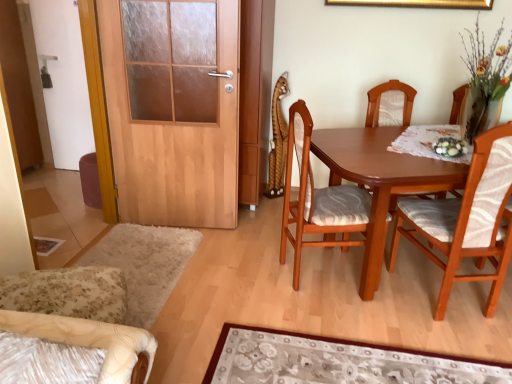
Where is `free region under wooden chair with patterned cushion at center, positioned as the third chair in right-to-left order (from a real-world perspective)`? free region under wooden chair with patterned cushion at center, positioned as the third chair in right-to-left order (from a real-world perspective) is located at coordinates (330, 274).